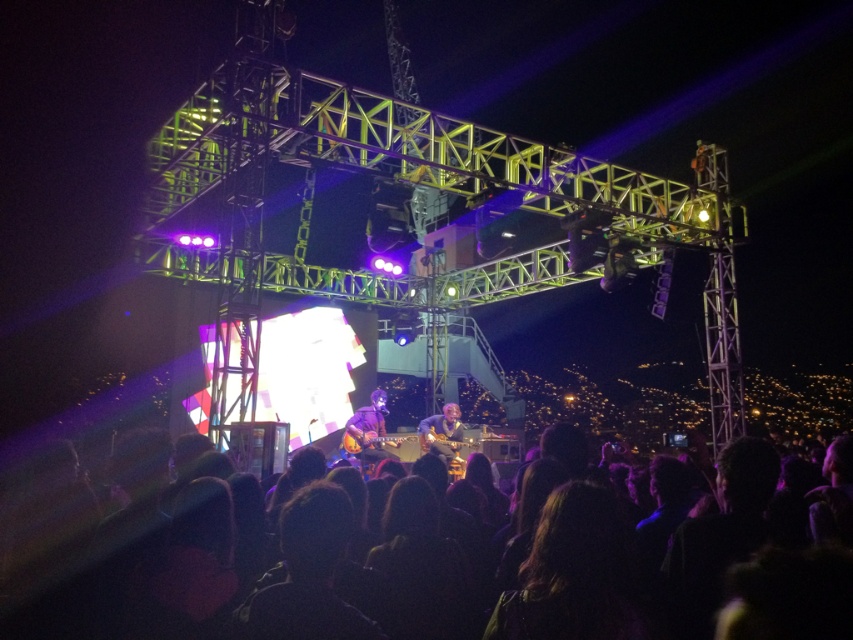
Is purple matte guitar at center positioned behind matte brown guitar at center?

No, purple matte guitar at center is in front of matte brown guitar at center.

Is point (355, 417) positioned before point (440, 429)?

No, (355, 417) is further to viewer.

Does point (368, 452) come behind point (456, 408)?

No, (368, 452) is closer to viewer.

This screenshot has height=640, width=853. What are the coordinates of `purple matte guitar at center` in the screenshot? It's located at (370, 428).

Is black hair at lower center further to camera compared to matte brown guitar at center?

That is False.

Does point (125, 634) lie in front of point (456, 432)?

Yes, it is in front of point (456, 432).

Which is behind, point (672, 563) or point (428, 445)?

Positioned behind is point (428, 445).

This screenshot has height=640, width=853. What are the coordinates of `black hair at lower center` in the screenshot? It's located at (144, 600).

Does point (607, 518) come behind point (373, 435)?

No, (607, 518) is closer to viewer.

Who is more forward, (132,536) or (375,429)?

Point (132,536)

Is point (202, 595) behind point (355, 422)?

That is False.

The width and height of the screenshot is (853, 640). Identify the location of black hair at lower center. (144, 600).